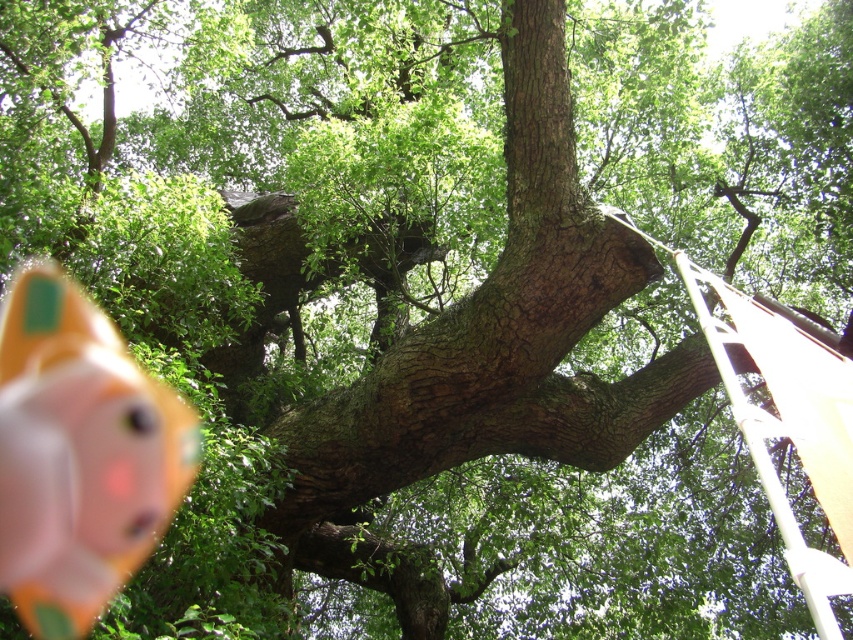
Who is lower down, pink rubber duck at lower left or white plastic ladder at right?

pink rubber duck at lower left is lower down.

Is pink rubber duck at lower left thinner than white plastic ladder at right?

Incorrect, pink rubber duck at lower left's width is not less than white plastic ladder at right's.

Between point (27, 305) and point (759, 413), which one is positioned behind?

The point (27, 305) is more distant.

You are a GUI agent. You are given a task and a screenshot of the screen. Output one action in this format:
    pyautogui.click(x=<x>, y=<y>)
    Task: Click on the pink rubber duck at lower left
    The image size is (853, 640).
    Given the screenshot: What is the action you would take?
    (x=79, y=454)